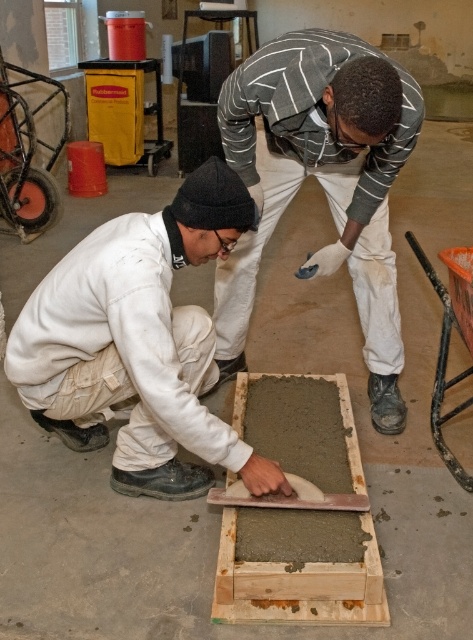
At what (x,y) coordinates should I click in order to perform the action: click on white matte uniform at lower left. Please return your answer as a coordinate pair (x, y). The width and height of the screenshot is (473, 640). Looking at the image, I should click on (139, 342).

Who is positioned more to the right, white matte uniform at lower left or striped sweater at center?

striped sweater at center is more to the right.

Locate an element on the screen. white matte uniform at lower left is located at coordinates (139, 342).

Consider the image. Can you confirm if white matte uniform at lower left is positioned to the left of smooth concrete plank at center?

Indeed, white matte uniform at lower left is positioned on the left side of smooth concrete plank at center.

Does white matte uniform at lower left have a lesser width compared to smooth concrete plank at center?

Incorrect, white matte uniform at lower left's width is not less than smooth concrete plank at center's.

Is point (133, 257) in front of point (241, 612)?

No, it is behind (241, 612).

Locate an element on the screen. Image resolution: width=473 pixels, height=640 pixels. white matte uniform at lower left is located at coordinates (139, 342).

Does striped sweater at center have a greater width compared to smooth concrete plank at center?

Yes.

Who is more forward, (287, 179) or (373, 596)?

Positioned in front is point (373, 596).

Where is `striped sweater at center`? Image resolution: width=473 pixels, height=640 pixels. striped sweater at center is located at coordinates click(x=322, y=182).